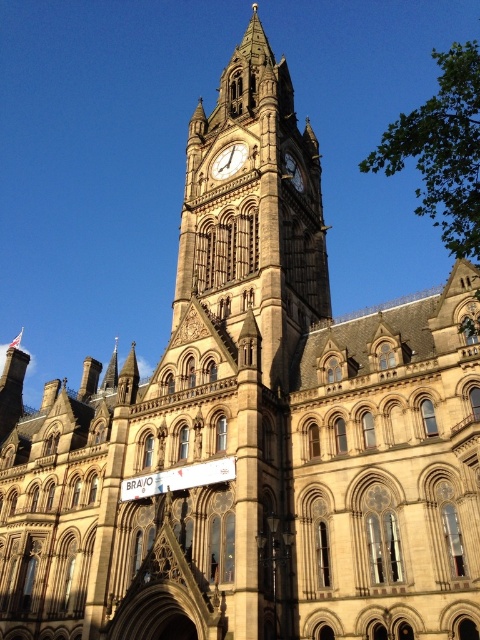
Question: Which of the following is the farthest from the observer?

Choices:
 (A) gold textured clock at center
 (B) brown stone clock tower at center

Answer: (A)

Question: Is brown stone clock tower at center closer to camera compared to gold textured clock at center?

Choices:
 (A) yes
 (B) no

Answer: (A)

Question: Can you confirm if brown stone clock tower at center is positioned above gold textured clock at center?

Choices:
 (A) no
 (B) yes

Answer: (B)

Question: Among these objects, which one is farthest from the camera?

Choices:
 (A) brown stone clock tower at center
 (B) gold textured clock at center

Answer: (B)

Question: Does brown stone clock tower at center appear on the left side of gold textured clock at center?

Choices:
 (A) no
 (B) yes

Answer: (A)